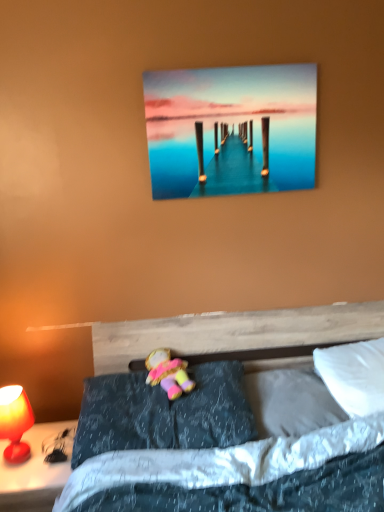
Question: Is metallic glossy pier at upper center in front of or behind matte red lamp at left in the image?

Choices:
 (A) behind
 (B) front

Answer: (A)

Question: Considering the positions of point (188, 138) and point (21, 451), is point (188, 138) closer or farther from the camera than point (21, 451)?

Choices:
 (A) closer
 (B) farther

Answer: (B)

Question: Estimate the real-world distances between objects in this image. Which object is farther from the matte red lamp at left?

Choices:
 (A) soft plush doll at center
 (B) matte red lamp at lower left
 (C) white soft pillow at lower right, which appears as the 2th pillow when viewed from the left
 (D) white soft pillow at upper right, which appears as the 1th pillow when viewed from the right
 (E) metallic glossy pier at upper center

Answer: (D)

Question: Estimate the real-world distances between objects in this image. Which object is closer to the white soft pillow at lower right, which is the second pillow from right to left?

Choices:
 (A) white soft pillow at upper right, the third pillow from the left
 (B) soft plush doll at center
 (C) dark gray fabric pillow at center, placed as the 3th pillow when sorted from right to left
 (D) metallic glossy pier at upper center
 (E) matte red lamp at left

Answer: (A)